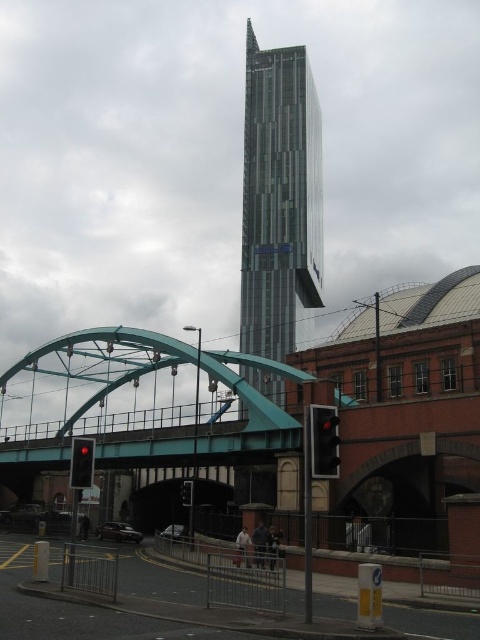
You are a city planner reviewing the urban scene. You need to determine which traffic light is more suitable for installation in a high pedestrian area. Considering their sizes, which traffic light between the red glass traffic light at lower left and the black plastic traffic light at lower center should be chosen?

The black plastic traffic light at lower center is larger than the red glass traffic light at lower left, making it more suitable for high pedestrian areas where visibility is crucial.

You are a pedestrian standing on the green pedestrian bridge. You want to cross the street to the glassy steel tower at center. Which direction should you head relative to the black plastic traffic light at lower center?

The glassy steel tower at center is to the right of the black plastic traffic light at lower center, so you should head to the right relative to the black plastic traffic light at lower center to reach it.